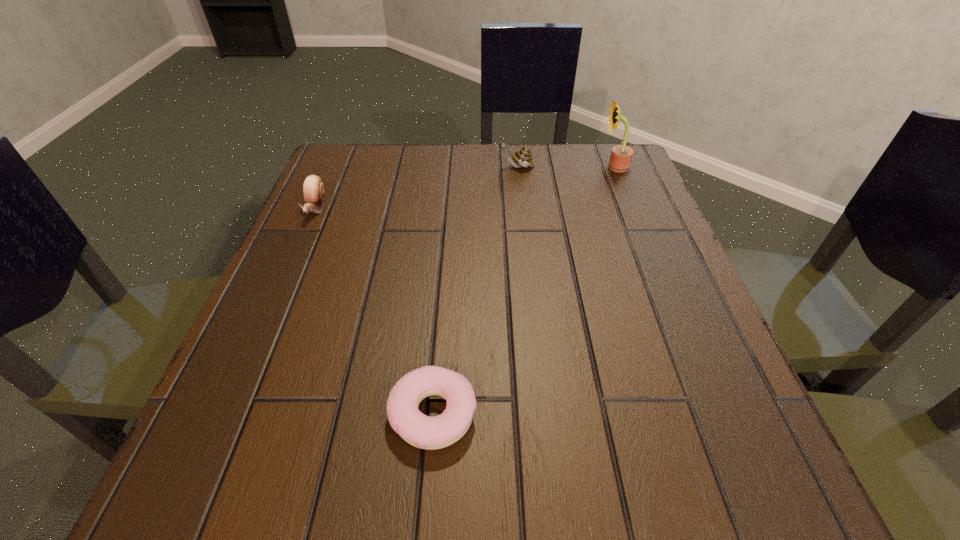
Where is `object located at the far left corner`? object located at the far left corner is located at coordinates (313, 188).

Where is `object present at the far right corner`? object present at the far right corner is located at coordinates (621, 155).

Locate an element on the screen. The image size is (960, 540). free space at the far edge of the desktop is located at coordinates (396, 196).

In the image, there is a desktop. Where is `blank space at the left edge`? This screenshot has width=960, height=540. blank space at the left edge is located at coordinates (293, 353).

The height and width of the screenshot is (540, 960). What are the coordinates of `vacant region at the right edge` in the screenshot? It's located at (698, 377).

Where is `vacant space at the far left corner of the desktop`? This screenshot has width=960, height=540. vacant space at the far left corner of the desktop is located at coordinates (362, 167).

At what (x,y) coordinates should I click in order to perform the action: click on vacant area at the near left corner of the desktop. Please return your answer as a coordinate pair (x, y). This screenshot has width=960, height=540. Looking at the image, I should click on (262, 472).

Where is `free space at the far right corner of the desktop`? free space at the far right corner of the desktop is located at coordinates (605, 163).

At what (x,y) coordinates should I click in order to perform the action: click on free location at the near right corner. Please return your answer as a coordinate pair (x, y). Looking at the image, I should click on (732, 491).

The width and height of the screenshot is (960, 540). I want to click on free spot between the left escargot and the sunflower, so pos(465,187).